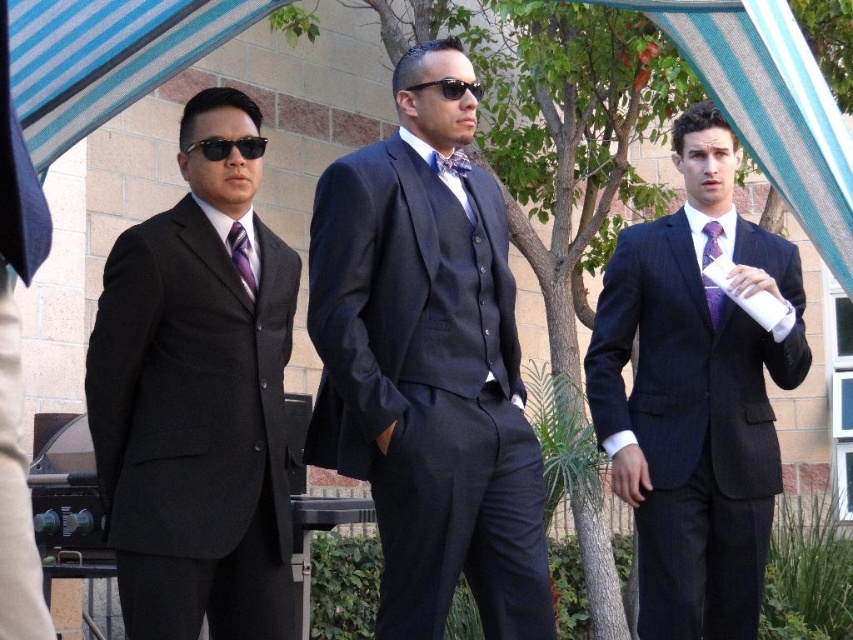
Question: Estimate the real-world distances between objects in this image. Which object is farther from the black reflective sunglasses at center?

Choices:
 (A) black reflective sunglasses at left
 (B) matte black suit at right

Answer: (B)

Question: Which object is farther from the camera taking this photo?

Choices:
 (A) purple satin tie at right
 (B) floral-patterned fabric tie at center
 (C) matte black suit at right

Answer: (A)

Question: Does purple satin tie at right appear on the right side of purple striped tie at left?

Choices:
 (A) no
 (B) yes

Answer: (B)

Question: Which point is farther to the camera?

Choices:
 (A) matte black suit at left
 (B) purple satin tie at right

Answer: (B)

Question: Can you confirm if purple satin tie at right is positioned to the right of black reflective sunglasses at center?

Choices:
 (A) no
 (B) yes

Answer: (B)

Question: Is matte black suit at left behind black reflective sunglasses at center?

Choices:
 (A) no
 (B) yes

Answer: (A)